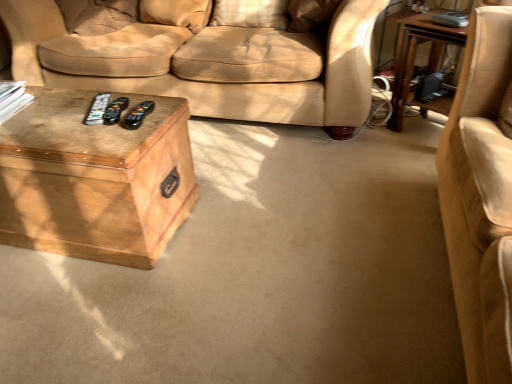
This screenshot has width=512, height=384. I want to click on vacant space to the left of black plastic remote at center, arranged as the 2th remote when viewed from the right, so click(71, 114).